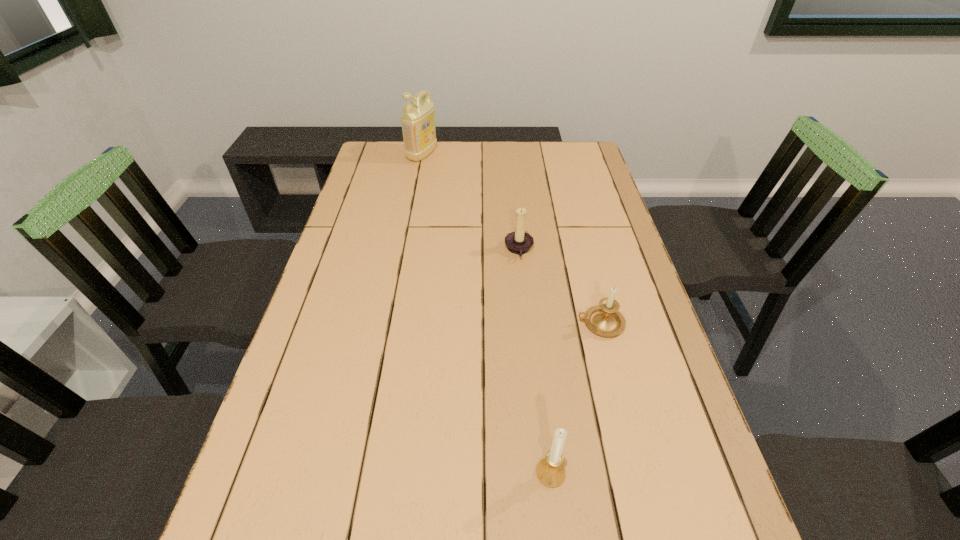
Find the location of a particular element. This screenshot has width=960, height=540. free spot between the rightmost candle holder and the nearest object is located at coordinates (575, 398).

This screenshot has width=960, height=540. I want to click on object that is the third closest to the tallest object, so click(x=550, y=471).

Find the location of a particular element. object that stands as the third closest to the farthest candle holder is located at coordinates pos(550,471).

Identify which candle holder is the nearest to the third nearest object. Please provide its 2D coordinates. Your answer should be formatted as a tuple, i.e. [(x, y)], where the tuple contains the x and y coordinates of a point satisfying the conditions above.

[(604, 319)]

Identify which candle holder is located as the nearest to the second farthest object. Please provide its 2D coordinates. Your answer should be formatted as a tuple, i.e. [(x, y)], where the tuple contains the x and y coordinates of a point satisfying the conditions above.

[(604, 319)]

Find the location of a particular element. free point that satisfies the following two spatial constraints: 1. on the wick of the nearest candle holder; 2. on the left side of the second farthest object is located at coordinates coord(540,473).

Find the location of a particular element. The height and width of the screenshot is (540, 960). free space that satisfies the following two spatial constraints: 1. on the wick of the farthest candle holder; 2. on the left side of the nearest object is located at coordinates (540, 473).

Where is `vacant space that satisfies the following two spatial constraints: 1. on the wick of the farthest candle holder; 2. on the left side of the nearest object`? This screenshot has height=540, width=960. vacant space that satisfies the following two spatial constraints: 1. on the wick of the farthest candle holder; 2. on the left side of the nearest object is located at coordinates (540, 473).

Where is `free space that satisfies the following two spatial constraints: 1. on the front side of the leftmost object; 2. on the left side of the nearest object`? The height and width of the screenshot is (540, 960). free space that satisfies the following two spatial constraints: 1. on the front side of the leftmost object; 2. on the left side of the nearest object is located at coordinates (361, 473).